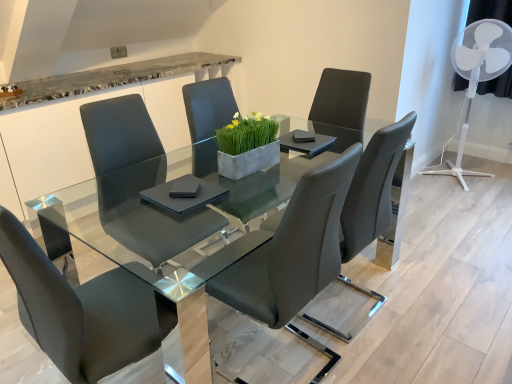
Question: From the image's perspective, is matte black chair at center, the 4th chair from the right, over transparent glass table at center?

Choices:
 (A) no
 (B) yes

Answer: (A)

Question: From a real-world perspective, is matte black chair at center, the first chair viewed from the left, physically above transparent glass table at center?

Choices:
 (A) yes
 (B) no

Answer: (A)

Question: Does matte black chair at center, the first chair viewed from the left, come in front of transparent glass table at center?

Choices:
 (A) no
 (B) yes

Answer: (B)

Question: Is matte black chair at center, the 4th chair from the right, completely or partially outside of transparent glass table at center?

Choices:
 (A) yes
 (B) no

Answer: (B)

Question: Are matte black chair at center, the 4th chair from the right, and transparent glass table at center far apart?

Choices:
 (A) no
 (B) yes

Answer: (A)

Question: In the image, is matte black chair at center, positioned as the second chair in left-to-right order, positioned in front of or behind matte black chair at center, the 2th chair when ordered from right to left?

Choices:
 (A) front
 (B) behind

Answer: (B)

Question: Which is correct: matte black chair at center, which is the 3th chair from right to left, is inside matte black chair at center, the 2th chair when ordered from right to left, or outside of it?

Choices:
 (A) outside
 (B) inside

Answer: (A)

Question: In terms of width, does matte black chair at center, which is the 3th chair from right to left, look wider or thinner when compared to matte black chair at center, the 2th chair when ordered from right to left?

Choices:
 (A) wide
 (B) thin

Answer: (B)

Question: Considering the positions of point (222, 89) and point (321, 220), is point (222, 89) closer or farther from the camera than point (321, 220)?

Choices:
 (A) closer
 (B) farther

Answer: (B)

Question: Does point (202, 155) appear closer or farther from the camera than point (379, 223)?

Choices:
 (A) closer
 (B) farther

Answer: (A)

Question: From the image's perspective, is matte black chair at center, positioned as the second chair in left-to-right order, above or below matte black chair at center, the 1th chair when ordered from right to left?

Choices:
 (A) below
 (B) above

Answer: (B)

Question: In the image, is matte black chair at center, which is the 3th chair from right to left, positioned in front of or behind matte black chair at center, the fourth chair viewed from the left?

Choices:
 (A) behind
 (B) front

Answer: (A)

Question: Is matte black chair at center, which is the 3th chair from right to left, inside the boundaries of matte black chair at center, the 1th chair when ordered from right to left, or outside?

Choices:
 (A) inside
 (B) outside

Answer: (B)

Question: Looking at their shapes, would you say matte black chair at center, positioned as the second chair in left-to-right order, is wider or thinner than white plastic fan at upper right?

Choices:
 (A) thin
 (B) wide

Answer: (B)

Question: Would you say matte black chair at center, positioned as the second chair in left-to-right order, is inside or outside white plastic fan at upper right?

Choices:
 (A) inside
 (B) outside

Answer: (B)